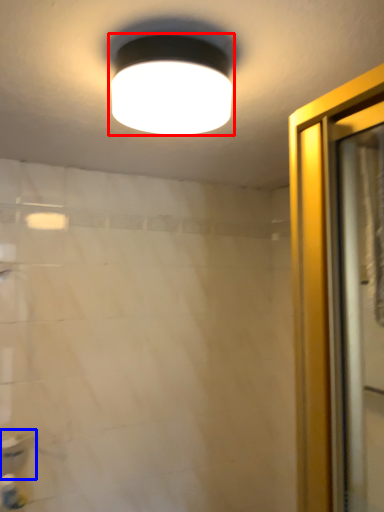
Question: Among these objects, which one is nearest to the camera, lamp (highlighted by a red box) or sink (highlighted by a blue box)?

Choices:
 (A) lamp
 (B) sink

Answer: (A)